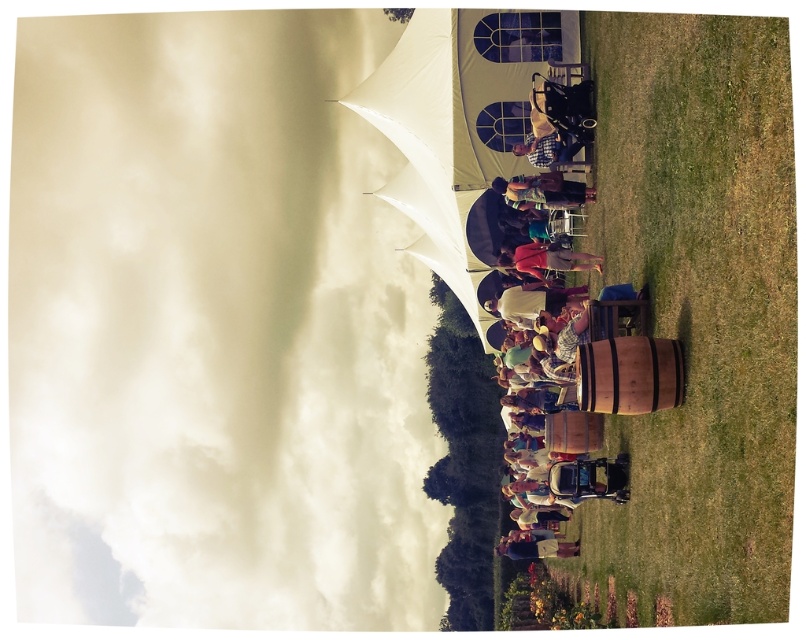
Question: Among these objects, which one is nearest to the camera?

Choices:
 (A) matte brown jacket at center
 (B) white fluffy cloud at upper left
 (C) matte red shirt at center
 (D) wooden barrel at center

Answer: (D)

Question: Estimate the real-world distances between objects in this image. Which object is closer to the denim jacket at lower center?

Choices:
 (A) wooden barrel at center
 (B) matte brown jacket at center
 (C) matte red shirt at center
 (D) wooden chair at center

Answer: (C)

Question: Among these points, which one is farthest from the camera?

Choices:
 (A) (387, 81)
 (B) (549, 172)
 (C) (547, 550)

Answer: (A)

Question: Does white fluffy cloud at upper left appear on the right side of matte red shirt at center?

Choices:
 (A) no
 (B) yes

Answer: (A)

Question: Is white fluffy cloud at upper left positioned behind matte red shirt at center?

Choices:
 (A) no
 (B) yes

Answer: (B)

Question: Does wooden barrel at center have a greater width compared to denim jacket at lower center?

Choices:
 (A) no
 (B) yes

Answer: (B)